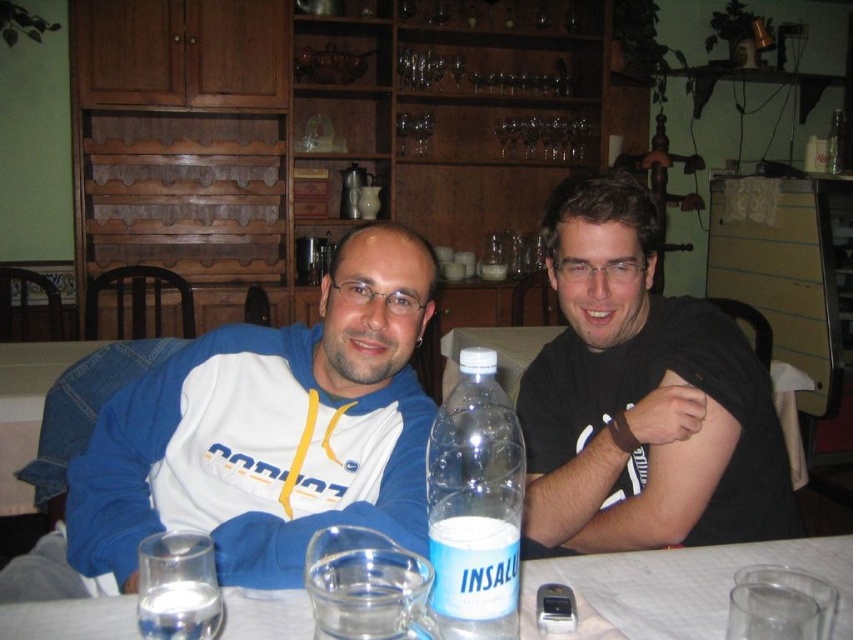
Question: Does black matte shirt at right appear under clear glass water at lower left?

Choices:
 (A) yes
 (B) no

Answer: (B)

Question: Considering the real-world distances, which object is closest to the clear glass water at lower center?

Choices:
 (A) black matte shirt at right
 (B) white fleece jacket at center
 (C) clear plastic bottle at center
 (D) clear glass water at lower left

Answer: (C)

Question: Among these points, which one is farthest from the camera?

Choices:
 (A) (641, 448)
 (B) (260, 452)

Answer: (A)

Question: Does white fleece jacket at center have a smaller size compared to black matte shirt at right?

Choices:
 (A) no
 (B) yes

Answer: (A)

Question: Among these points, which one is farthest from the camera?

Choices:
 (A) (486, 365)
 (B) (405, 333)
 (C) (639, 426)
 (D) (598, 637)

Answer: (B)

Question: Can you confirm if white fleece jacket at center is positioned to the left of clear glass water at lower left?

Choices:
 (A) no
 (B) yes

Answer: (A)